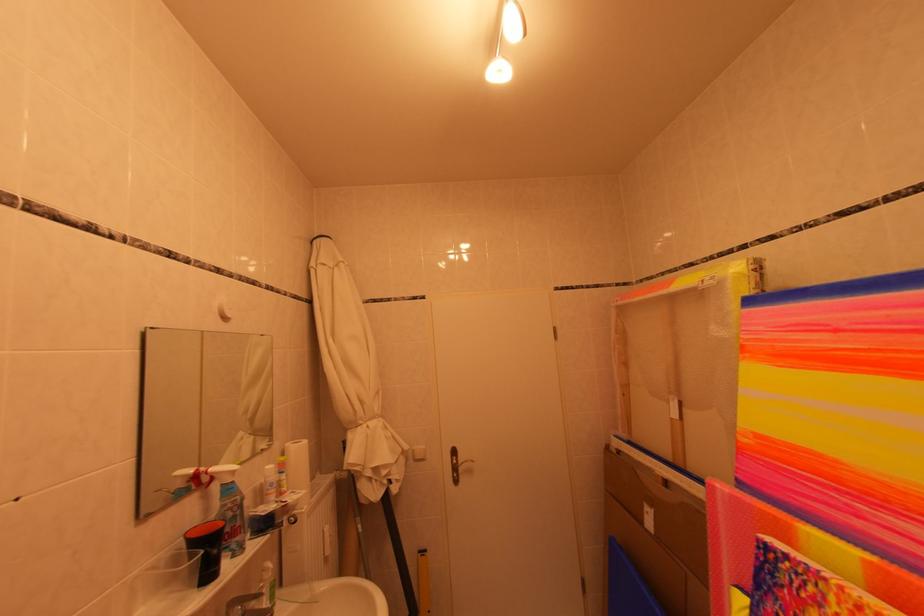
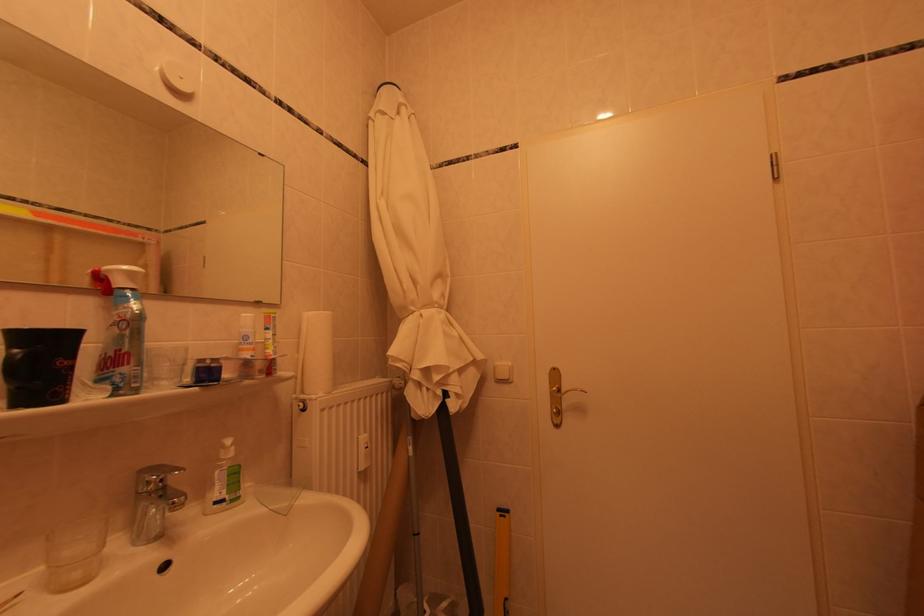
The point at [249,538] is marked in the first image. Where is the corresponding point in the second image?

(138, 368)